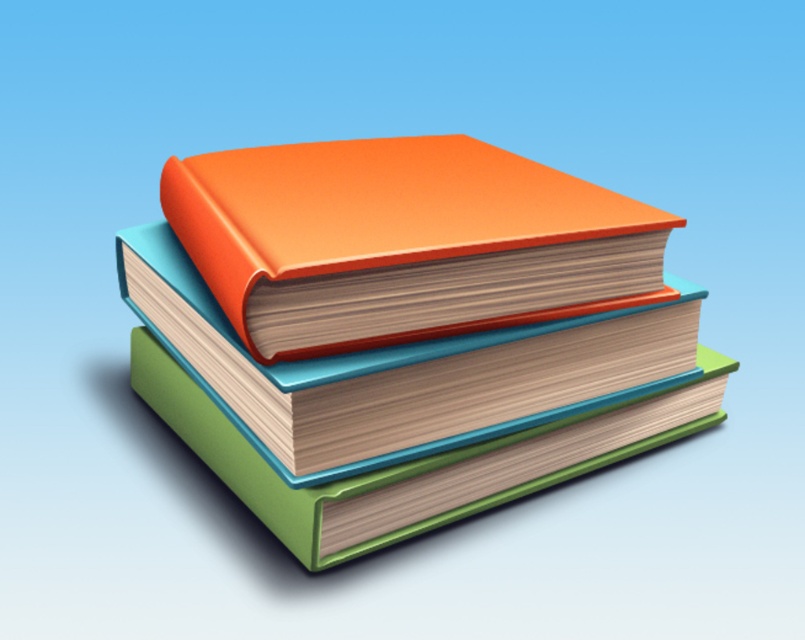
Question: Is the position of orange matte book at center more distant than that of orange matte hardback book at center?

Choices:
 (A) no
 (B) yes

Answer: (B)

Question: Can you confirm if orange matte book at center is bigger than orange matte hardback book at center?

Choices:
 (A) no
 (B) yes

Answer: (B)

Question: Which point appears farthest from the camera in this image?

Choices:
 (A) click(x=262, y=232)
 (B) click(x=679, y=426)

Answer: (B)

Question: Does orange matte book at center appear under orange matte hardback book at center?

Choices:
 (A) yes
 (B) no

Answer: (A)